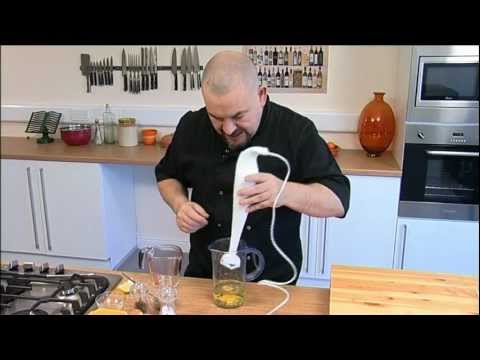
Find the location of a particular element. The width and height of the screenshot is (480, 360). glass is located at coordinates (232, 280).